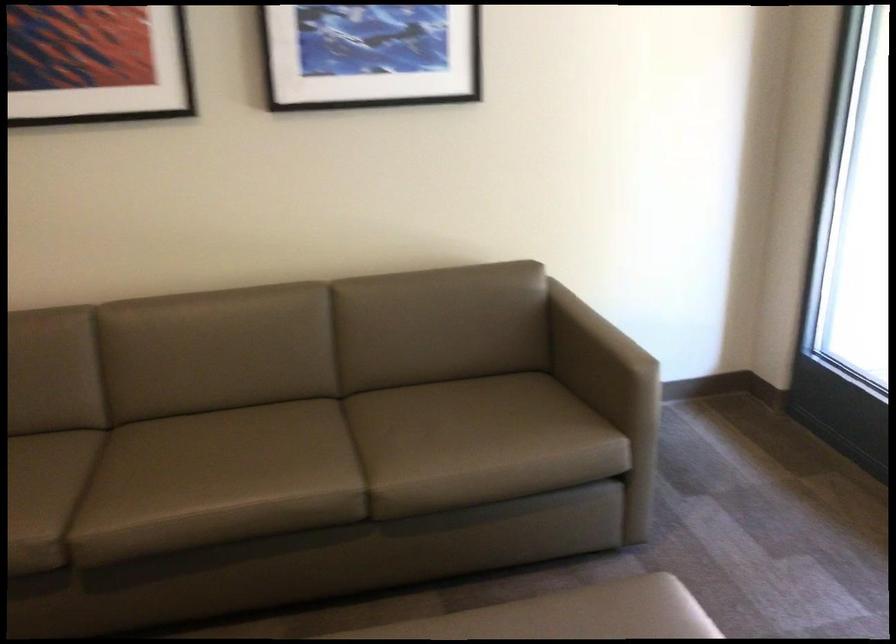
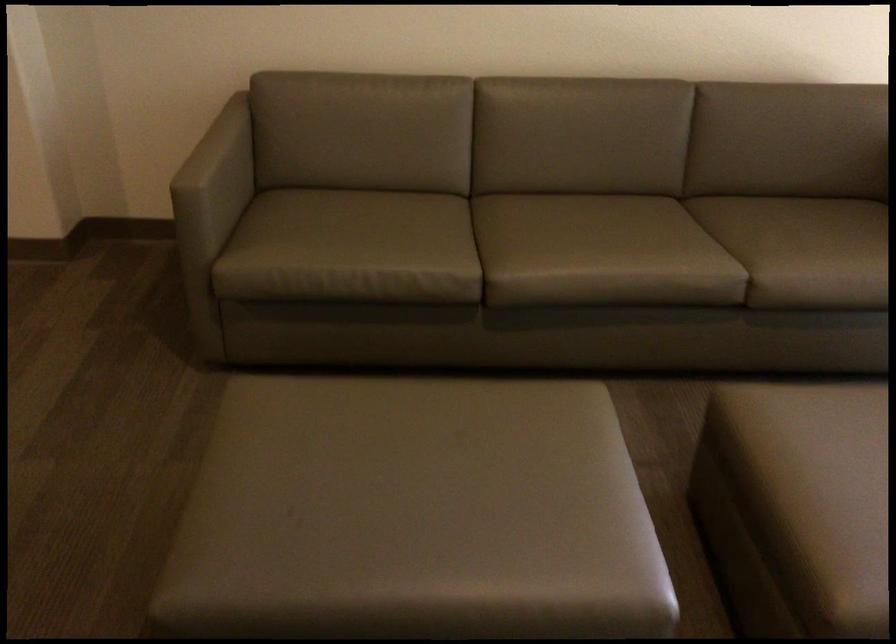
Where in the second image is the point corresponding to the point at 462,446 from the first image?

(819, 251)